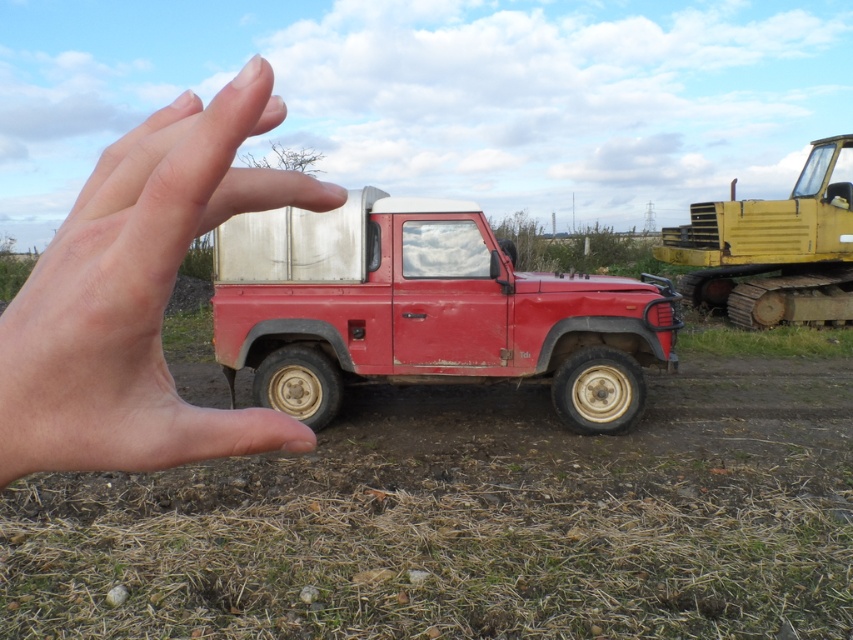
Question: Which of the following is the closest to the observer?

Choices:
 (A) (70, 300)
 (B) (242, 221)
 (C) (811, 168)

Answer: (A)

Question: Does rusty metal truck at center appear on the left side of skinny flesh at center?

Choices:
 (A) yes
 (B) no

Answer: (B)

Question: Is rusty metal truck at center further to camera compared to yellow rubber tracked vehicle at right?

Choices:
 (A) no
 (B) yes

Answer: (A)

Question: In this image, where is rusty metal truck at center located relative to skinny flesh at center?

Choices:
 (A) right
 (B) left

Answer: (A)

Question: Which is nearer to the yellow rubber tracked vehicle at right?

Choices:
 (A) rusty metal truck at center
 (B) skinny flesh at center

Answer: (A)

Question: Which object is farther from the camera taking this photo?

Choices:
 (A) yellow rubber tracked vehicle at right
 (B) rusty metal truck at center
 (C) skinny flesh at center

Answer: (A)